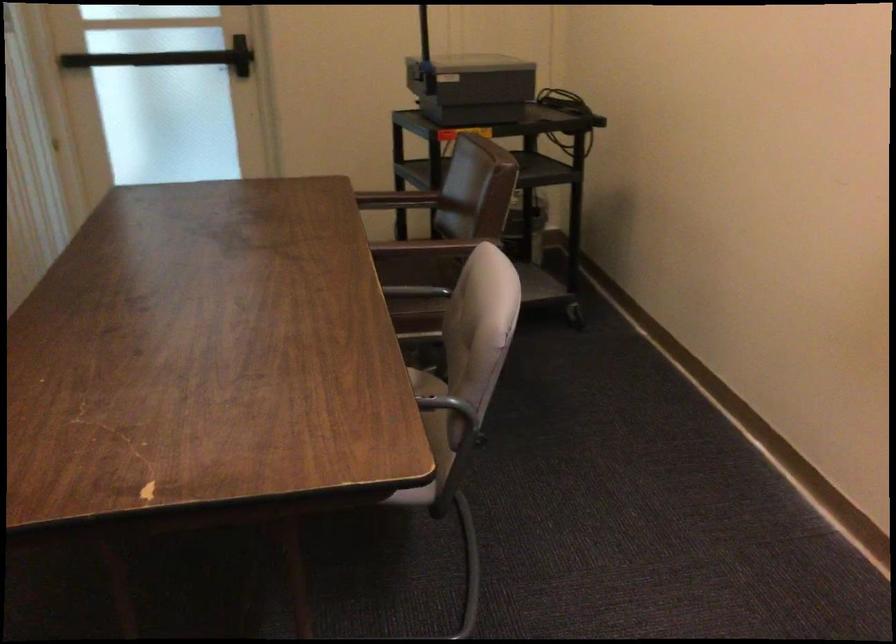
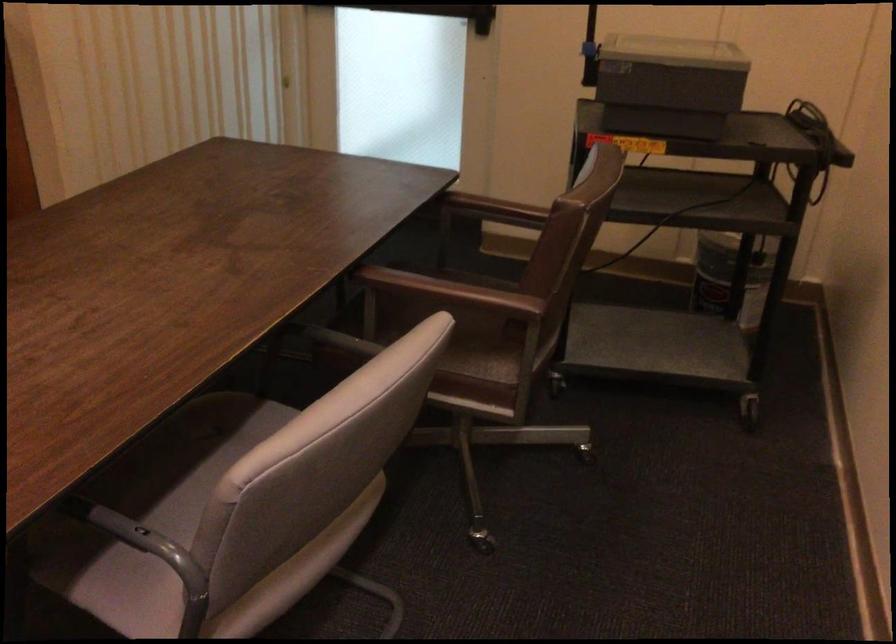
Where in the second image is the point corresponding to the point at 400,404 from the first image?

(140, 538)